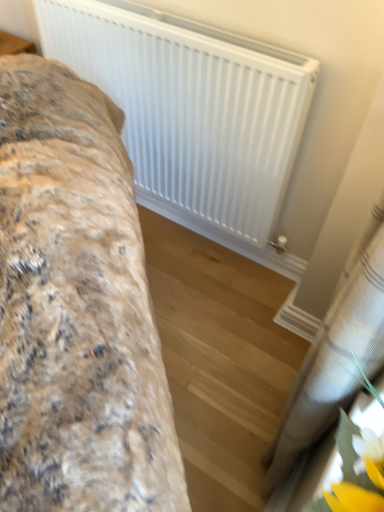
The width and height of the screenshot is (384, 512). Identify the location of blank space situated above white matte radiator at upper center (from a real-world perspective). (193, 13).